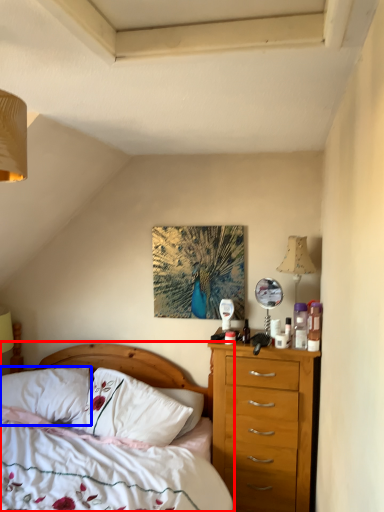
Question: Which object appears closest to the camera in this image, bed (highlighted by a red box) or pillow (highlighted by a blue box)?

Choices:
 (A) bed
 (B) pillow

Answer: (A)